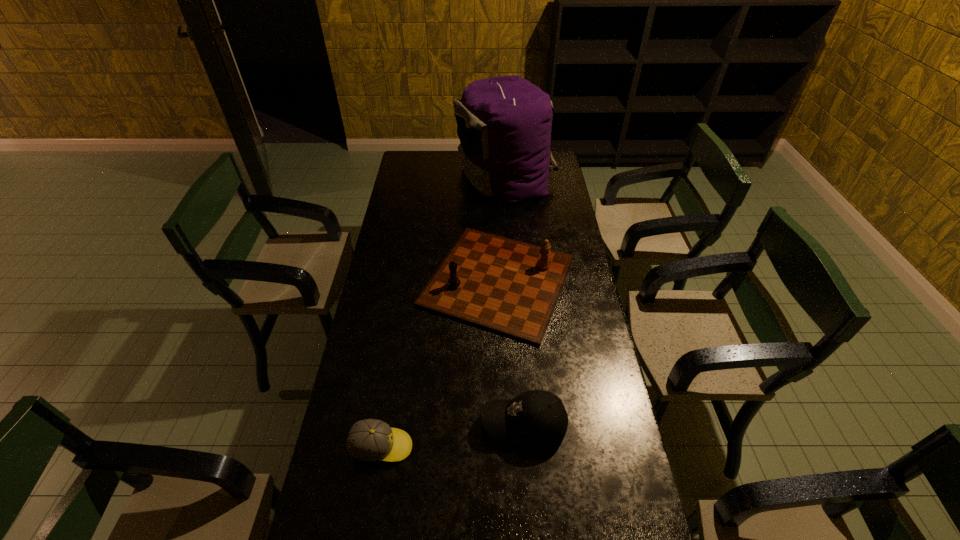
The image size is (960, 540). Identify the location of free spot located on the front pocket of the backpack. (430, 177).

Where is `free spot located 0.140m on the back of the second tallest object`? This screenshot has width=960, height=540. free spot located 0.140m on the back of the second tallest object is located at coordinates (495, 211).

Locate an element on the screen. The width and height of the screenshot is (960, 540). free region located 0.270m on the front-facing side of the right baseball cap is located at coordinates (391, 425).

Where is `vacant space located 0.100m on the front-facing side of the right baseball cap`? This screenshot has width=960, height=540. vacant space located 0.100m on the front-facing side of the right baseball cap is located at coordinates (447, 425).

In order to click on vacant point located 0.360m on the front-facing side of the right baseball cap in this screenshot , I will do `click(360, 425)`.

At what (x,y) coordinates should I click in order to perform the action: click on vacant area situated 0.070m on the front-facing side of the shorter baseball cap. Please return your answer as a coordinate pair (x, y). The image size is (960, 540). Looking at the image, I should click on (437, 447).

What are the coordinates of `object present at the far edge` in the screenshot? It's located at (504, 124).

The height and width of the screenshot is (540, 960). Identify the location of object at the left edge. (372, 440).

Find the location of `backpack at the right edge`. backpack at the right edge is located at coordinates [504, 124].

Locate an element on the screen. This screenshot has height=540, width=960. gameboard located in the right edge section of the desktop is located at coordinates (504, 285).